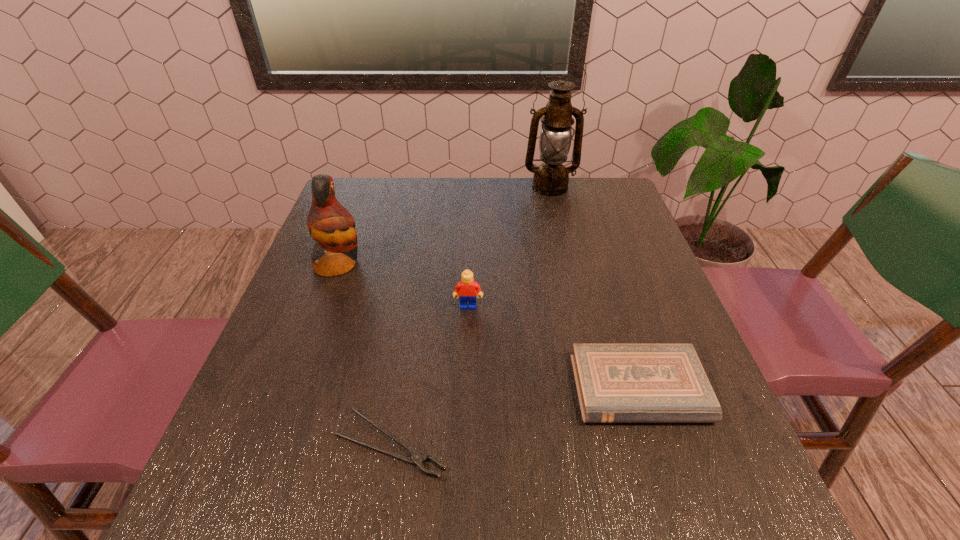
This screenshot has height=540, width=960. Find the location of `the tallest object`. the tallest object is located at coordinates (551, 178).

Identify the location of the farthest object. (551, 178).

Locate an element on the screen. This screenshot has width=960, height=540. the fourth shortest object is located at coordinates (330, 224).

Find the location of a particular element. The image size is (960, 540). parrot is located at coordinates (330, 224).

Identify the location of the third shortest object. This screenshot has width=960, height=540. (467, 288).

You are a GUI agent. You are given a task and a screenshot of the screen. Output one action in this format:
    pyautogui.click(x=<x>, y=<y>)
    Task: Click on the Lego
    
    Given the screenshot: What is the action you would take?
    pyautogui.click(x=467, y=288)

At what (x,y) coordinates should I click in order to perform the action: click on Bible. Please return your answer as a coordinate pair (x, y). Looking at the image, I should click on (616, 383).

Where is `the shortest object`? This screenshot has height=540, width=960. the shortest object is located at coordinates tap(416, 458).

Locate an element on the screen. free space located on the left of the tallest object is located at coordinates (396, 187).

I want to click on free space located 0.170m on the face of the second tallest object, so (430, 265).